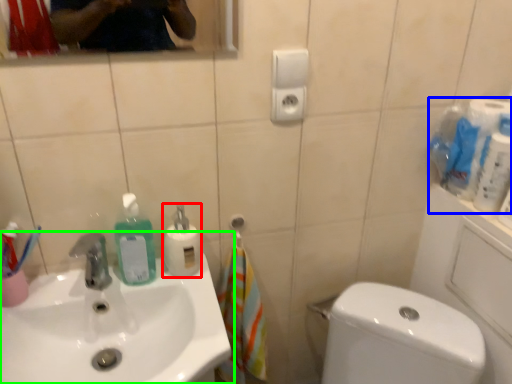
Question: Which object is positioned closest to cleaning product (highlighted by a red box)? Select from toilet paper (highlighted by a blue box) and sink (highlighted by a green box).

Choices:
 (A) toilet paper
 (B) sink

Answer: (B)